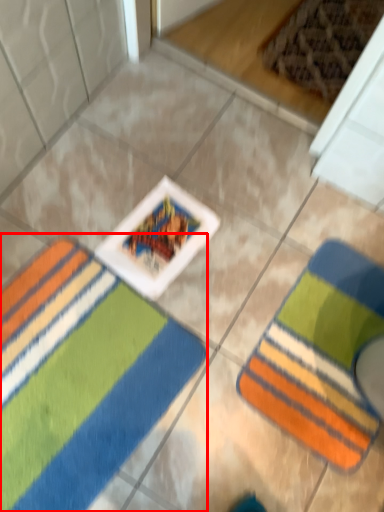
Question: Considering the relative positions of towel (annotated by the red box) and towel in the image provided, where is towel (annotated by the red box) located with respect to the staircase?

Choices:
 (A) left
 (B) right

Answer: (A)